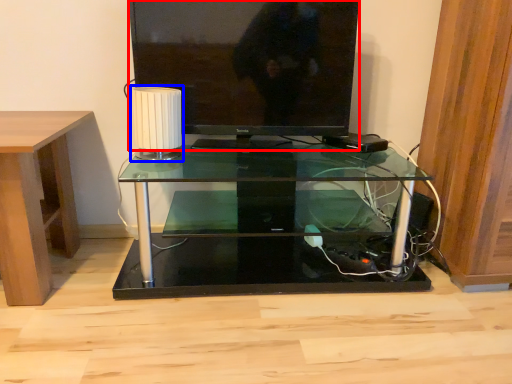
Question: Among these objects, which one is farthest to the camera, television (highlighted by a red box) or lamp (highlighted by a blue box)?

Choices:
 (A) television
 (B) lamp

Answer: (A)